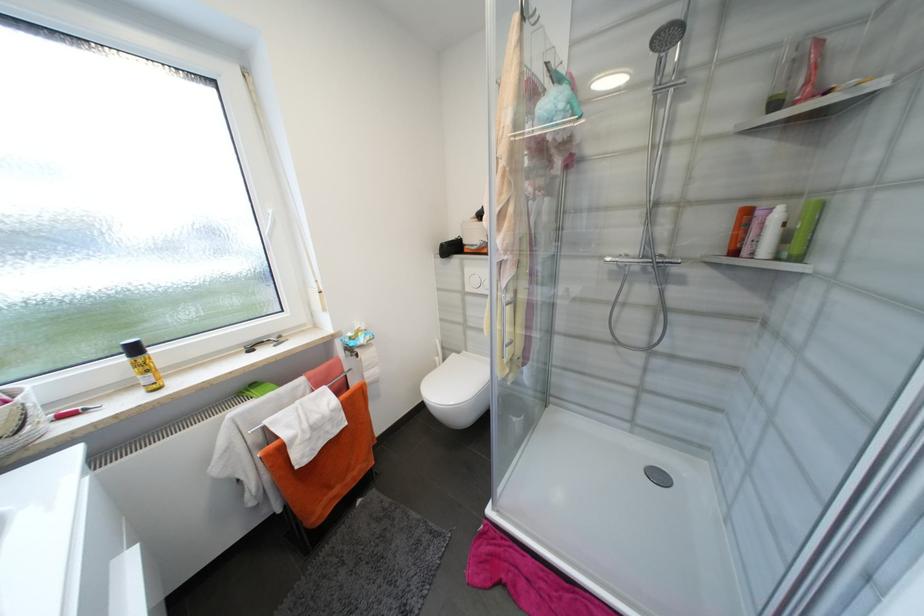
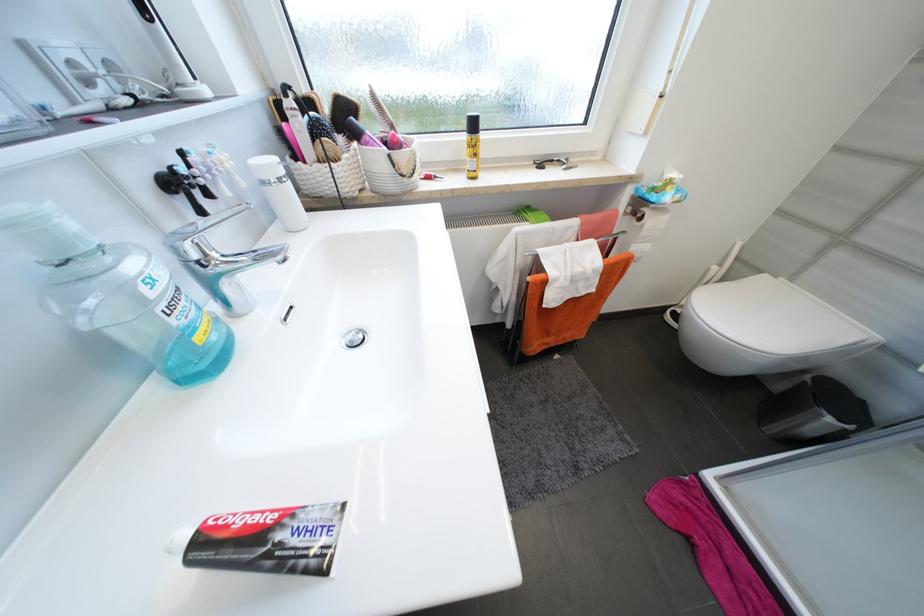
Where in the second image is the point corresponding to the point at 549,586 from the first image?

(759, 596)